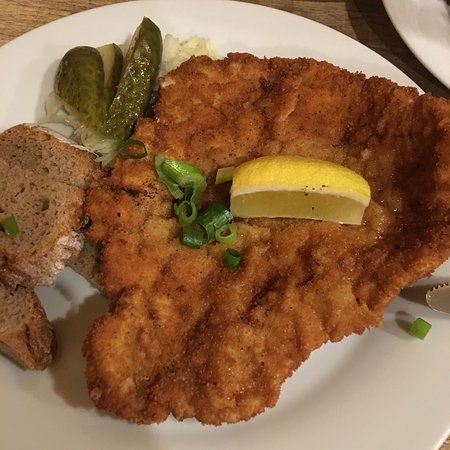
Locate an element on the screen. This screenshot has height=450, width=450. table top is located at coordinates (28, 11).